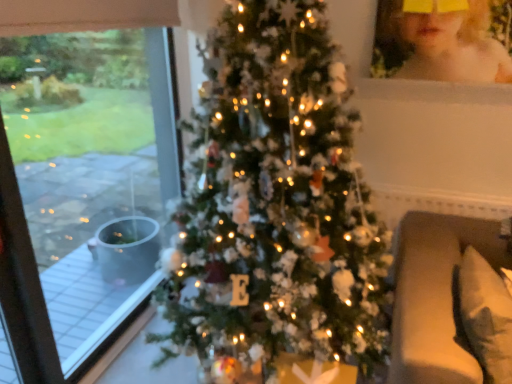
Question: Relative to transparent glass window at left, is beige fabric couch at right in front or behind?

Choices:
 (A) front
 (B) behind

Answer: (A)

Question: Considering the relative positions of beige fabric couch at right and transparent glass window at left in the image provided, is beige fabric couch at right to the left or to the right of transparent glass window at left?

Choices:
 (A) right
 (B) left

Answer: (A)

Question: Based on their relative distances, which object is nearer to the blonde hair at upper right?

Choices:
 (A) transparent glass window at left
 (B) beige fabric couch at right
 (C) green matte christmas tree at center
 (D) white soft pillow at lower right

Answer: (B)

Question: Which object is the farthest from the white soft pillow at lower right?

Choices:
 (A) transparent glass window at left
 (B) green matte christmas tree at center
 (C) beige fabric couch at right
 (D) blonde hair at upper right

Answer: (A)